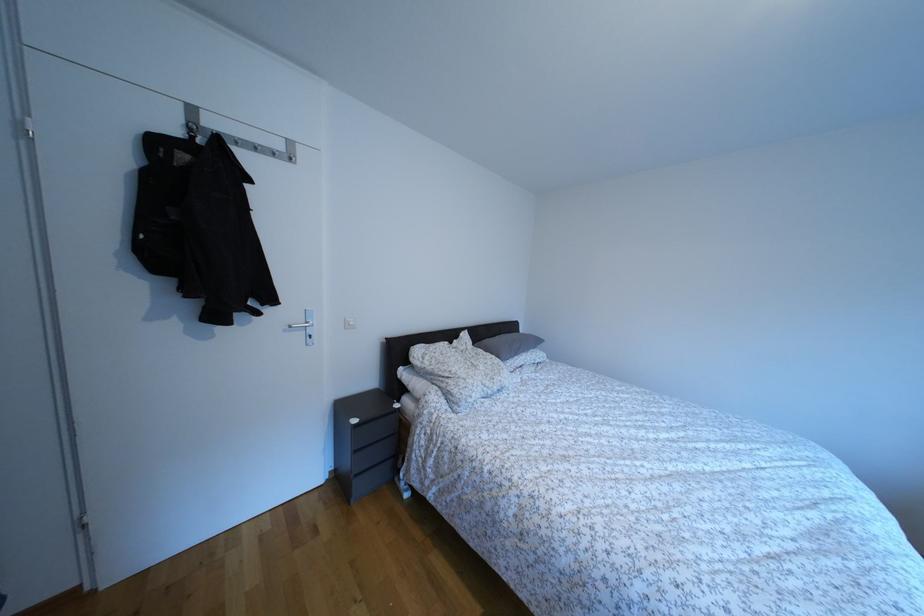
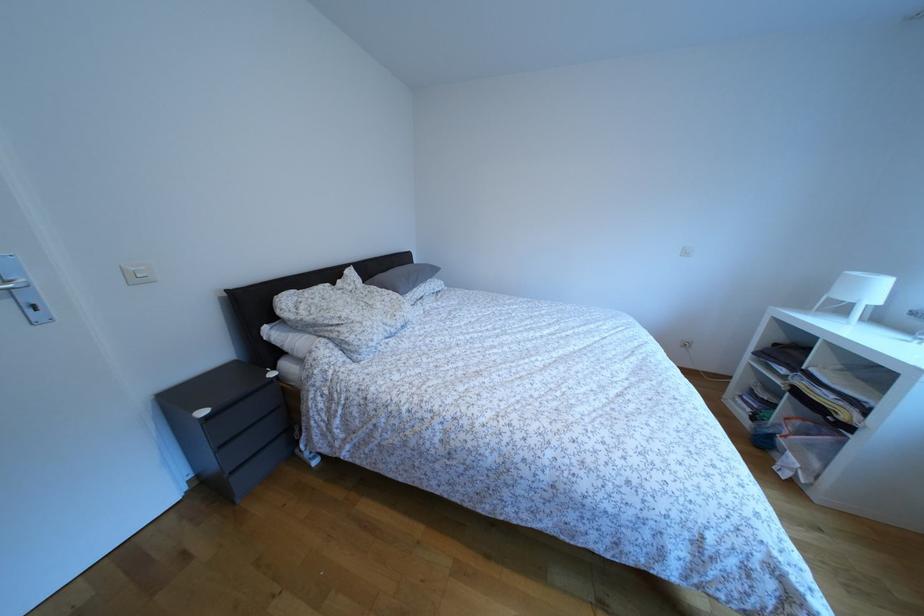
Question: In a continuous first-person perspective shot, in which direction is the camera moving?

Choices:
 (A) Left
 (B) Right
 (C) Forward
 (D) Backward

Answer: (C)